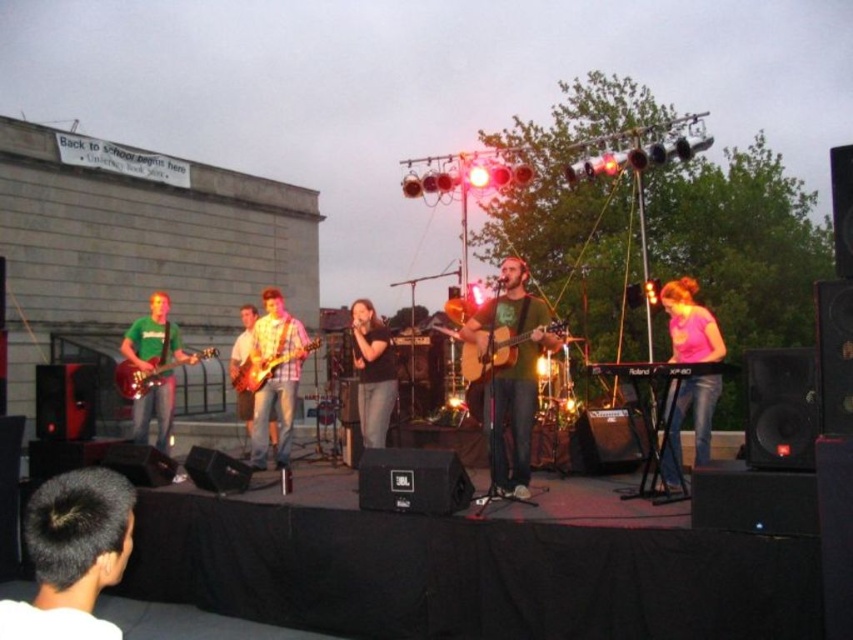
Question: Which point is closer to the camera?

Choices:
 (A) (677, 301)
 (B) (511, 362)
 (C) (279, 401)
 (D) (138, 356)

Answer: (B)

Question: Which object appears closest to the camera in this image?

Choices:
 (A) green matte guitar at left
 (B) pink matte shirt at right
 (C) wooden electric guitar at center
 (D) matte red electric guitar at left

Answer: (B)

Question: Which is farther from the black hair at lower left?

Choices:
 (A) matte wood guitar at center
 (B) black matte shirt at center
 (C) wooden guitar at center

Answer: (C)

Question: Does green matte guitar at left appear over black matte shirt at center?

Choices:
 (A) yes
 (B) no

Answer: (A)

Question: Is matte green guitar at center in front of green matte guitar at left?

Choices:
 (A) yes
 (B) no

Answer: (A)

Question: From the image, what is the correct spatial relationship of green matte shirt at center in relation to matte wood guitar at center?

Choices:
 (A) below
 (B) above

Answer: (A)